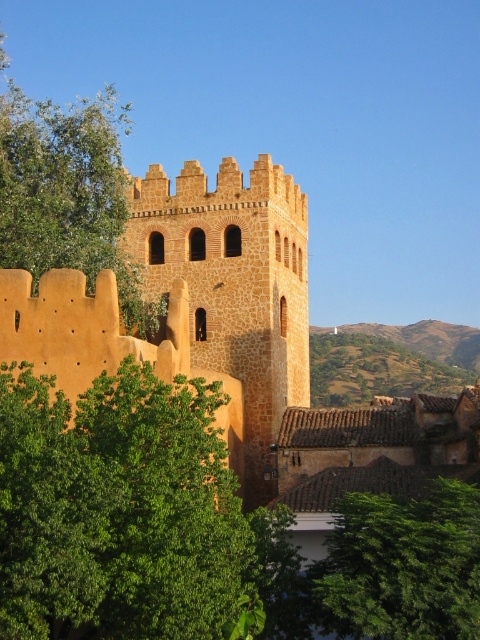
Question: Is green leafy tree at lower left wider than green leafy tree at upper left?

Choices:
 (A) yes
 (B) no

Answer: (B)

Question: Which point is farther to the camera?

Choices:
 (A) (212, 516)
 (B) (417, 612)
 (C) (22, 224)
 (D) (271, 480)

Answer: (D)

Question: Which of these objects is positioned farthest from the green leafy tree at lower right?

Choices:
 (A) green leafy tree at upper left
 (B) golden stone tower at center
 (C) green leafy tree at lower left

Answer: (A)

Question: Which point is farther to the camera?

Choices:
 (A) (425, 572)
 (B) (0, 397)
 (C) (271, 253)

Answer: (C)

Question: Can you confirm if green leafy tree at lower left is positioned to the right of golden stone tower at center?

Choices:
 (A) yes
 (B) no

Answer: (B)

Question: Can you confirm if green leafy tree at lower left is thinner than green leafy tree at upper left?

Choices:
 (A) yes
 (B) no

Answer: (A)